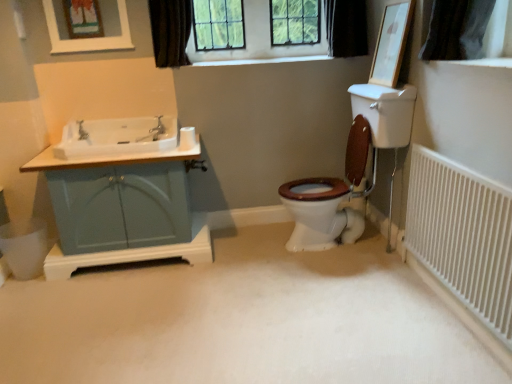
At what (x,y) coordinates should I click in order to perform the action: click on unoccupied area in front of white matte toilet paper at upper center. Please return your answer as a coordinate pair (x, y). The image size is (512, 384). Looking at the image, I should click on (176, 145).